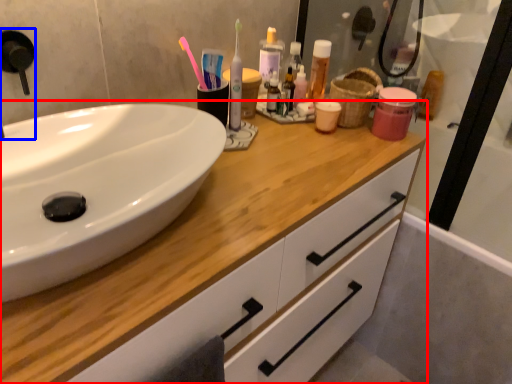
Question: Among these objects, which one is farthest to the camera, bathroom cabinet (highlighted by a red box) or faucet (highlighted by a blue box)?

Choices:
 (A) bathroom cabinet
 (B) faucet

Answer: (B)